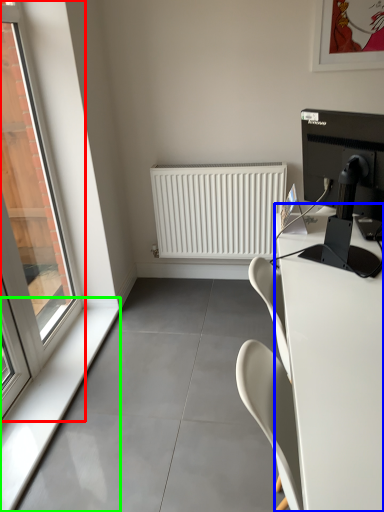
Question: Which object is positioned closest to window (highlighted by a red box)? Select from desk (highlighted by a blue box) and window sill (highlighted by a green box).

Choices:
 (A) desk
 (B) window sill

Answer: (B)